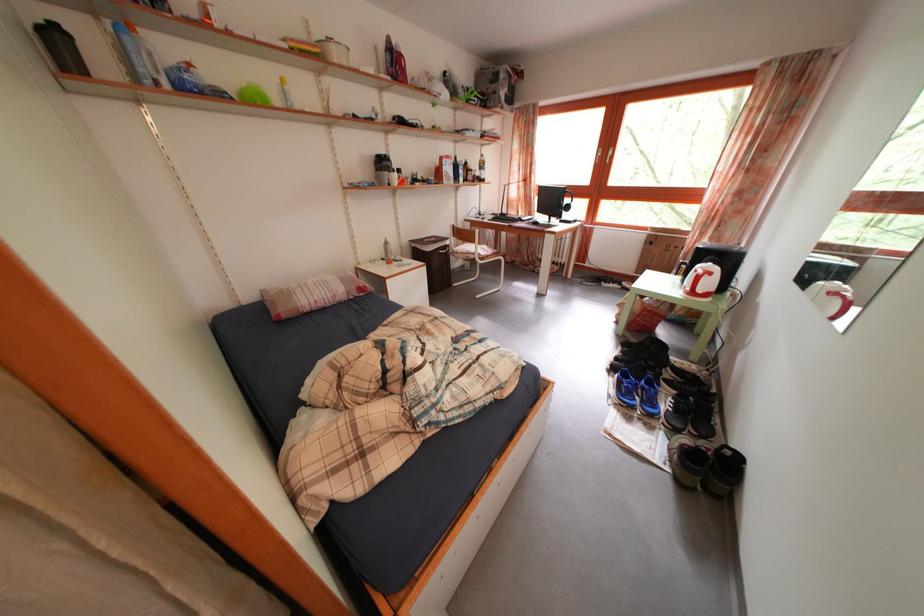
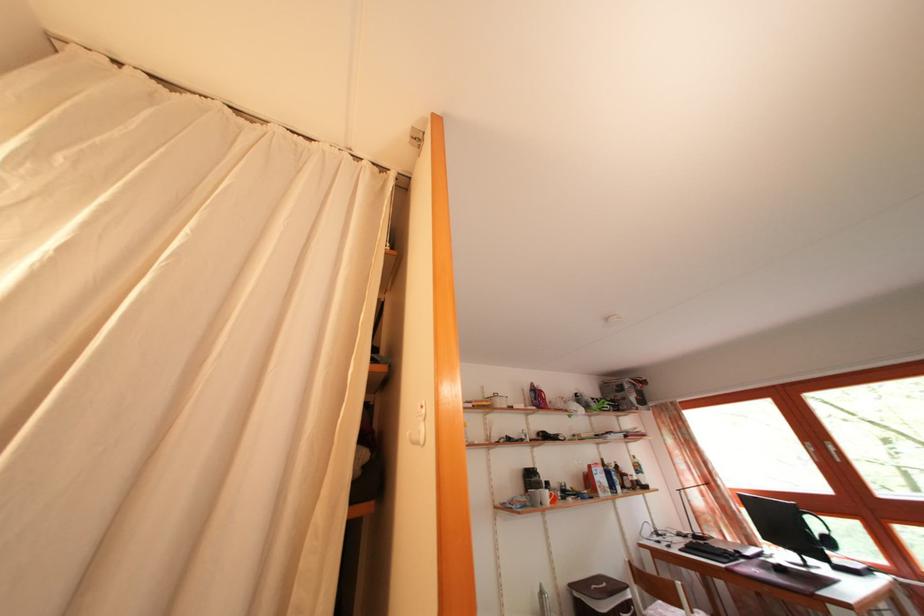
Find the pixel in the second image that matches point (403, 182) in the first image.

(554, 499)